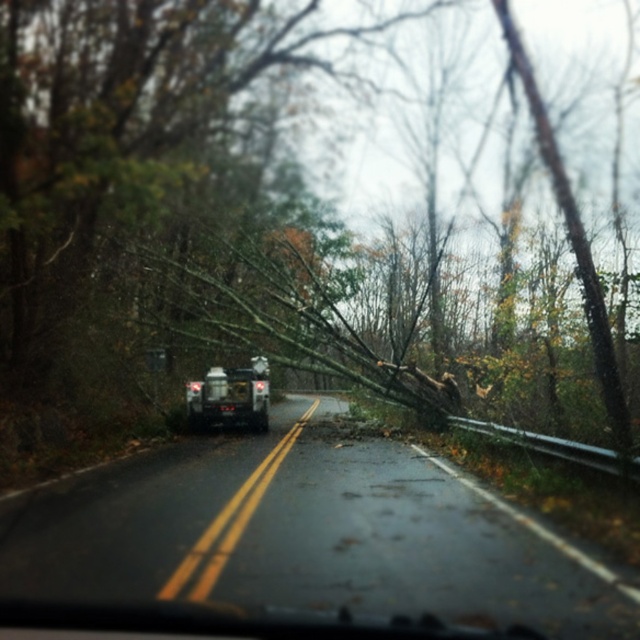
You are a driver approaching the brown wood tree at center and the black asphalt road at center. Which object is closer to the right edge of the road?

The brown wood tree at center is positioned on the right side of black asphalt road at center, so it is closer to the right edge of the road.

You are driving a car that is 15 feet long. You are currently on the black asphalt road at center and want to pass through a narrow tunnel ahead. The tunnel entrance is 17 feet away from your current position. Can your car fit through the tunnel entrance?

The distance between the black asphalt road at center and the camera is 17.31 feet. Since the tunnel entrance is 17 feet away, your car, which is 15 feet long, can fit through the tunnel entrance as it is shorter than the available distance.

You are a driver in a car with a 10 meter long trailer attached. You need to pass through a point located at coordinates point (385, 385). Given that the distance from your current position to that point is 23.06 meters, can your trailer safely navigate this path without any obstacles?

The distance from the viewer to point (385, 385) is 23.06 meters. Since the trailer is 10 meters long, the total length required would be at least 10 meters. However, the available distance is 23.06 meters, which is more than enough for the trailer to navigate safely as long as there are no obstacles in between.